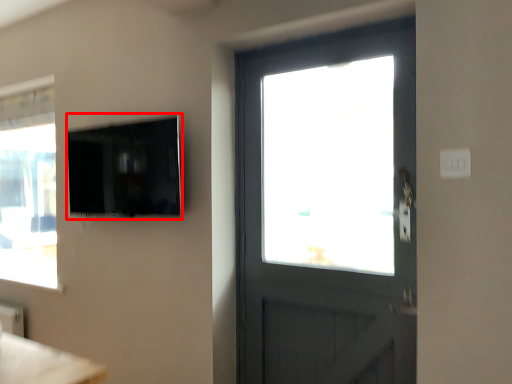
Question: From the image's perspective, where is window screen (annotated by the red box) located in relation to light switch in the image?

Choices:
 (A) below
 (B) above

Answer: (B)